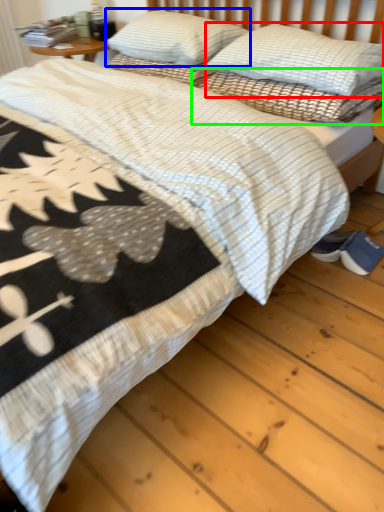
Question: Estimate the real-world distances between objects in this image. Which object is closer to pillow (highlighted by a red box), pillow (highlighted by a blue box) or pillow (highlighted by a green box)?

Choices:
 (A) pillow
 (B) pillow

Answer: (B)